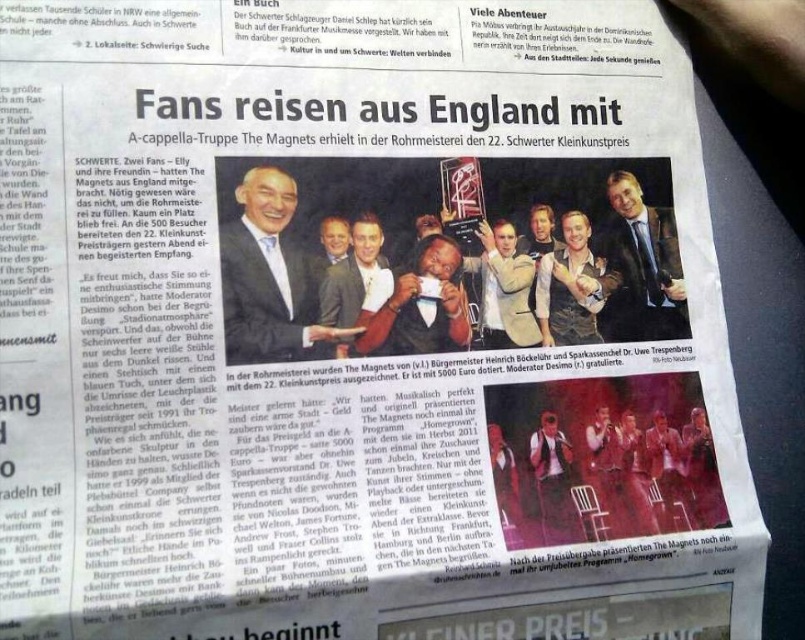
Question: Which point is closer to the camera taking this photo?

Choices:
 (A) (372, 221)
 (B) (543, 438)
 (C) (347, 230)

Answer: (C)

Question: Is light brown leather jacket at center further to camera compared to smooth skin face at center?

Choices:
 (A) yes
 (B) no

Answer: (A)

Question: Considering the real-world distances, which object is farthest from the matte black suit at upper right?

Choices:
 (A) matte black suit at center
 (B) matte black sunglasses at center
 (C) shiny blue suit at center

Answer: (C)

Question: Based on their relative distances, which object is nearer to the matte black suit at center?

Choices:
 (A) light brown leather jacket at center
 (B) matte black sunglasses at center
 (C) matte black suit at upper right

Answer: (A)

Question: Is shiny blue suit at center thinner than matte black sunglasses at center?

Choices:
 (A) yes
 (B) no

Answer: (B)

Question: In this image, where is matte black suit at upper right located relative to matte black suit at center?

Choices:
 (A) right
 (B) left

Answer: (A)